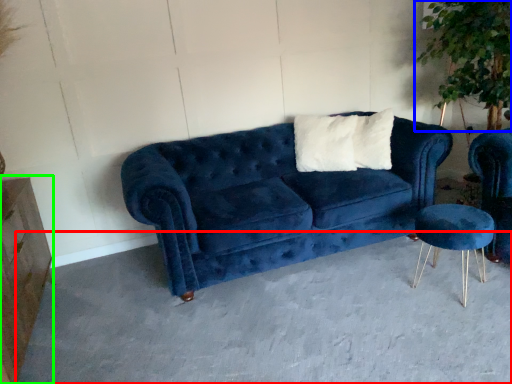
Question: Estimate the real-world distances between objects in this image. Which object is closer to concrete (highlighted by a red box), plant (highlighted by a blue box) or dresser (highlighted by a green box)?

Choices:
 (A) plant
 (B) dresser

Answer: (B)